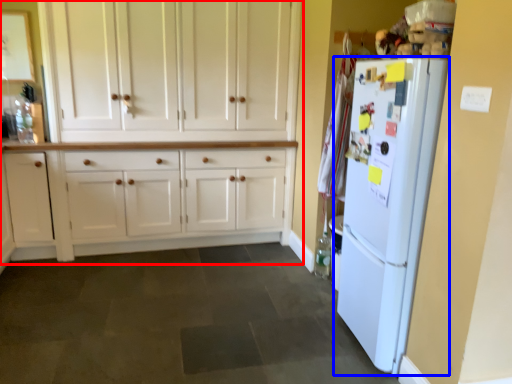
Question: Which object appears closest to the camera in this image, cabinetry (highlighted by a red box) or refrigerator (highlighted by a blue box)?

Choices:
 (A) cabinetry
 (B) refrigerator

Answer: (B)